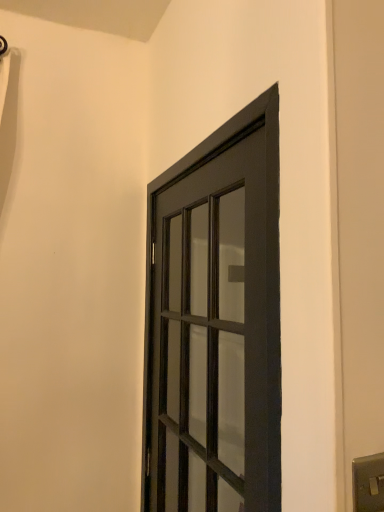
Question: Is matte black door at center at the right side of satin silver switch at lower right?

Choices:
 (A) yes
 (B) no

Answer: (B)

Question: Does matte black door at center turn towards satin silver switch at lower right?

Choices:
 (A) no
 (B) yes

Answer: (A)

Question: Is there a large distance between matte black door at center and satin silver switch at lower right?

Choices:
 (A) yes
 (B) no

Answer: (B)

Question: From a real-world perspective, is matte black door at center over satin silver switch at lower right?

Choices:
 (A) no
 (B) yes

Answer: (B)

Question: From a real-world perspective, is matte black door at center under satin silver switch at lower right?

Choices:
 (A) yes
 (B) no

Answer: (B)

Question: From the image's perspective, is matte black door at center on top of satin silver switch at lower right?

Choices:
 (A) yes
 (B) no

Answer: (A)

Question: Is satin silver switch at lower right smaller than matte black door at center?

Choices:
 (A) yes
 (B) no

Answer: (A)

Question: Would you say satin silver switch at lower right is outside matte black door at center?

Choices:
 (A) no
 (B) yes

Answer: (B)

Question: Is the surface of satin silver switch at lower right in direct contact with matte black door at center?

Choices:
 (A) no
 (B) yes

Answer: (A)

Question: Can you confirm if satin silver switch at lower right is shorter than matte black door at center?

Choices:
 (A) no
 (B) yes

Answer: (B)

Question: Does satin silver switch at lower right have a lesser width compared to matte black door at center?

Choices:
 (A) yes
 (B) no

Answer: (A)

Question: From the image's perspective, would you say satin silver switch at lower right is shown under matte black door at center?

Choices:
 (A) no
 (B) yes

Answer: (B)

Question: Based on their sizes in the image, would you say matte black door at center is bigger or smaller than satin silver switch at lower right?

Choices:
 (A) small
 (B) big

Answer: (B)